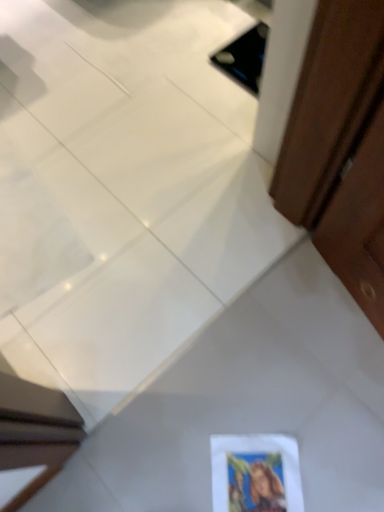
Locate an element on the screen. This screenshot has height=512, width=384. blank area beneath white paper postcard at lower center (from a real-world perspective) is located at coordinates (261, 482).